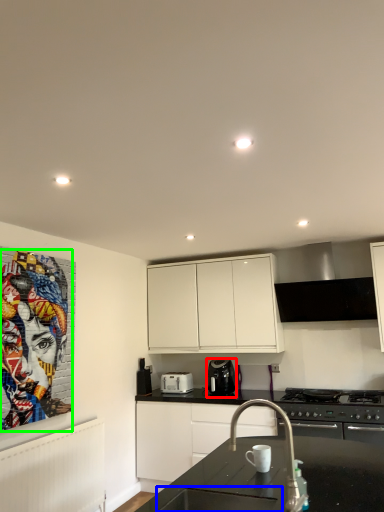
Question: Based on their relative distances, which object is nearer to kitchen appliance (highlighted by a red box)? Choose from sink (highlighted by a blue box) and person (highlighted by a green box).

Choices:
 (A) sink
 (B) person

Answer: (B)